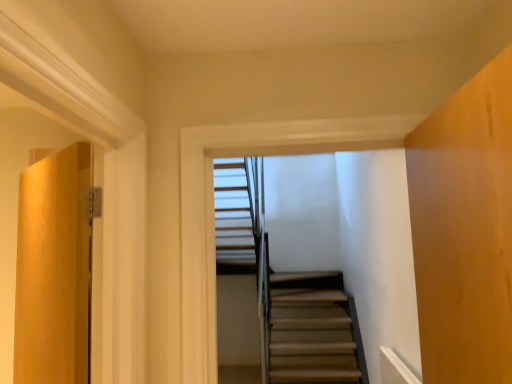
Question: Considering the positions of matte wood door at left and wooden stairs at center in the image, is matte wood door at left taller or shorter than wooden stairs at center?

Choices:
 (A) tall
 (B) short

Answer: (A)

Question: Is matte wood door at left in front of or behind wooden stairs at center in the image?

Choices:
 (A) front
 (B) behind

Answer: (A)

Question: Is matte wood door at left bigger or smaller than wooden stairs at center?

Choices:
 (A) big
 (B) small

Answer: (A)

Question: From the image's perspective, is wooden stairs at center positioned above or below matte wood door at left?

Choices:
 (A) above
 (B) below

Answer: (A)

Question: Is wooden stairs at center inside or outside of matte wood door at left?

Choices:
 (A) outside
 (B) inside

Answer: (A)

Question: Would you say wooden stairs at center is to the left or to the right of matte wood door at left in the picture?

Choices:
 (A) right
 (B) left

Answer: (A)

Question: From a real-world perspective, relative to matte wood door at left, is wooden stairs at center vertically above or below?

Choices:
 (A) above
 (B) below

Answer: (A)